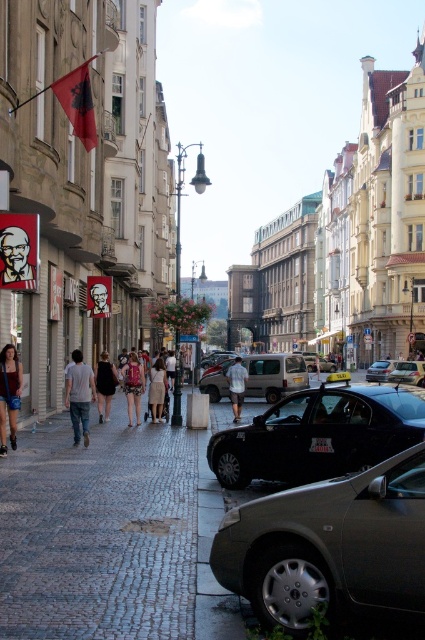
Question: Is silver metallic van at center below metallic silver taxi at center?

Choices:
 (A) yes
 (B) no

Answer: (B)

Question: Considering the relative positions of khaki shorts at center and metallic silver car at center in the image provided, where is khaki shorts at center located with respect to metallic silver car at center?

Choices:
 (A) above
 (B) below

Answer: (A)

Question: Based on their relative distances, which object is farther from the shiny black car at center?

Choices:
 (A) black dress at center
 (B) matte pink dress at center
 (C) khaki shorts at center

Answer: (C)

Question: Which point appears farthest from the camera in this image?

Choices:
 (A) (387, 394)
 (B) (368, 380)
 (C) (51, 518)
 (D) (237, 394)

Answer: (B)

Question: Which point is closer to the camera?

Choices:
 (A) (96, 365)
 (B) (351, 579)
 (C) (291, 362)
 (D) (152, 388)

Answer: (B)

Question: Is denim shorts at lower left thinner than matte pink dress at center?

Choices:
 (A) no
 (B) yes

Answer: (B)